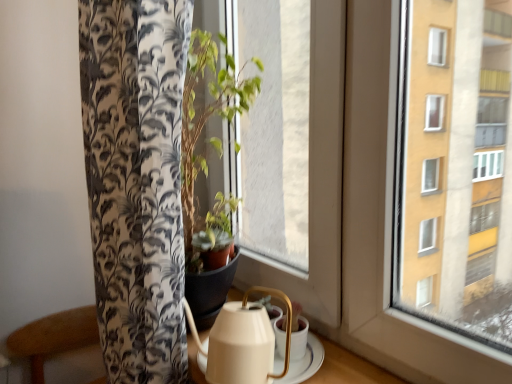
Question: From the image's perspective, relative to transparent glass window at center, is white ceramic tea set at lower center above or below?

Choices:
 (A) below
 (B) above

Answer: (A)

Question: Considering the positions of white ceramic tea set at lower center and transparent glass window at center in the image, is white ceramic tea set at lower center taller or shorter than transparent glass window at center?

Choices:
 (A) tall
 (B) short

Answer: (B)

Question: From a real-world perspective, is white ceramic tea set at lower center physically located above or below transparent glass window at center?

Choices:
 (A) below
 (B) above

Answer: (A)

Question: Choose the correct answer: Is transparent glass window at center inside white ceramic tea set at lower center or outside it?

Choices:
 (A) inside
 (B) outside

Answer: (B)

Question: Is point (324, 240) positioned closer to the camera than point (253, 317)?

Choices:
 (A) closer
 (B) farther

Answer: (B)

Question: Considering the positions of transparent glass window at center and white ceramic tea set at lower center in the image, is transparent glass window at center bigger or smaller than white ceramic tea set at lower center?

Choices:
 (A) small
 (B) big

Answer: (B)

Question: From a real-world perspective, is transparent glass window at center positioned above or below white ceramic tea set at lower center?

Choices:
 (A) above
 (B) below

Answer: (A)